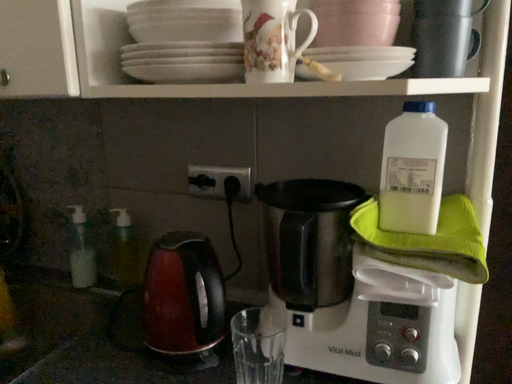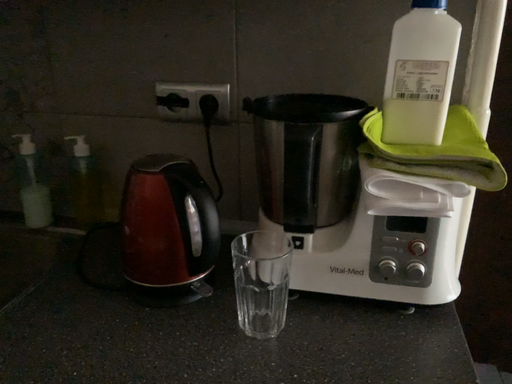
Question: Which way did the camera rotate in the video?

Choices:
 (A) rotated left
 (B) rotated right

Answer: (B)